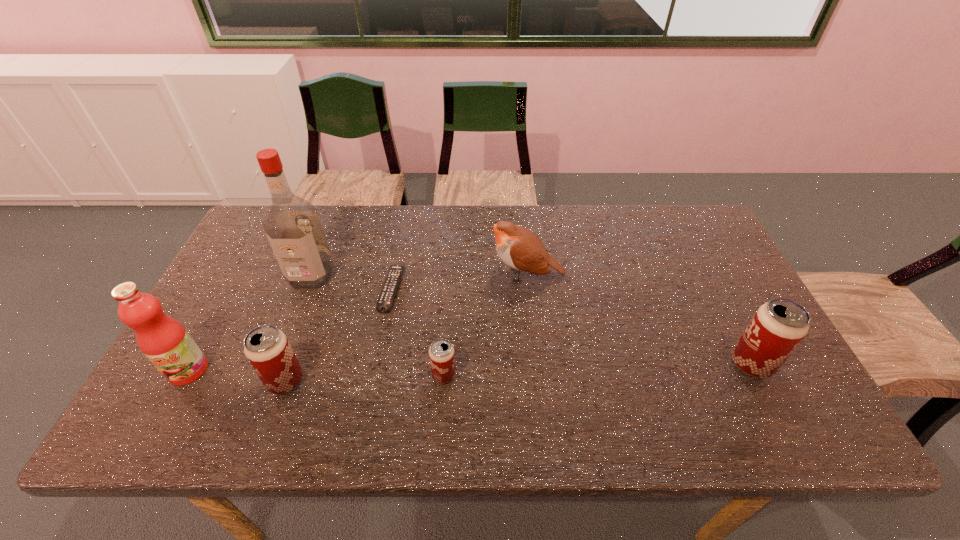
Locate an element on the screen. the closest beer can to the second shortest beer can is located at coordinates (441, 353).

The height and width of the screenshot is (540, 960). I want to click on vacant area that satisfies the following two spatial constraints: 1. at the face of the second object from right to left; 2. on the front-facing side of the liquor, so click(x=525, y=275).

This screenshot has height=540, width=960. I want to click on free space that satisfies the following two spatial constraints: 1. on the front label of the sixth tallest object; 2. on the right side of the leftmost object, so click(x=186, y=375).

At what (x,y) coordinates should I click in order to perform the action: click on vacant area that satisfies the following two spatial constraints: 1. on the front-facing side of the tallest object; 2. on the right side of the rightmost beer can. Please return your answer as a coordinate pair (x, y). The width and height of the screenshot is (960, 540). Looking at the image, I should click on (277, 364).

Find the location of a particular element. The width and height of the screenshot is (960, 540). free space that satisfies the following two spatial constraints: 1. at the face of the sixth object from left to right; 2. on the front side of the fourth object from right to left is located at coordinates (527, 289).

Where is `free spot that satisfies the following two spatial constraints: 1. on the front label of the second beer can from left to right; 2. on the right side of the fruit juice`? free spot that satisfies the following two spatial constraints: 1. on the front label of the second beer can from left to right; 2. on the right side of the fruit juice is located at coordinates (186, 375).